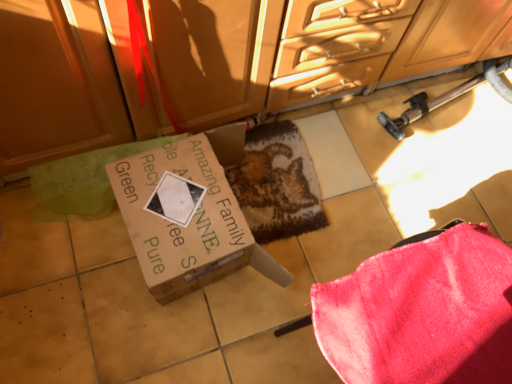
Locate an element on the screen. The width and height of the screenshot is (512, 384). empty space that is ontop of brown cardboard box at center (from a real-world perspective) is located at coordinates (181, 203).